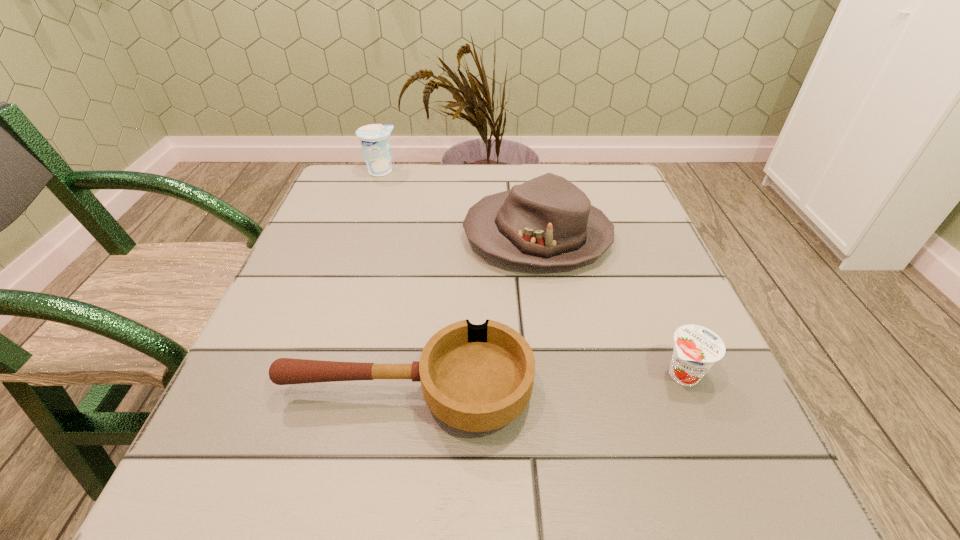
Identify the location of the second farthest object. This screenshot has width=960, height=540. (547, 221).

Find the location of `the taller yogurt`. the taller yogurt is located at coordinates (375, 138).

I want to click on the farthest object, so click(x=375, y=138).

At what (x,y) coordinates should I click in order to perform the action: click on saucepan. Please return your answer as a coordinate pair (x, y). This screenshot has height=540, width=960. Looking at the image, I should click on (477, 378).

At what (x,y) coordinates should I click in order to perform the action: click on the nearer yogurt. Please return your answer as a coordinate pair (x, y). Looking at the image, I should click on (696, 349).

Find the location of `the right yogurt`. the right yogurt is located at coordinates (696, 349).

Identify the location of free location located 0.110m on the decorative side of the second farthest object. (412, 236).

Where is `vacant space located 0.320m on the decorative side of the second farthest object`? vacant space located 0.320m on the decorative side of the second farthest object is located at coordinates (314, 236).

I want to click on free space located on the decorative side of the second farthest object, so point(430,236).

Image resolution: width=960 pixels, height=540 pixels. Find the location of `free region located 0.400m on the front of the farther yogurt`. free region located 0.400m on the front of the farther yogurt is located at coordinates (342, 286).